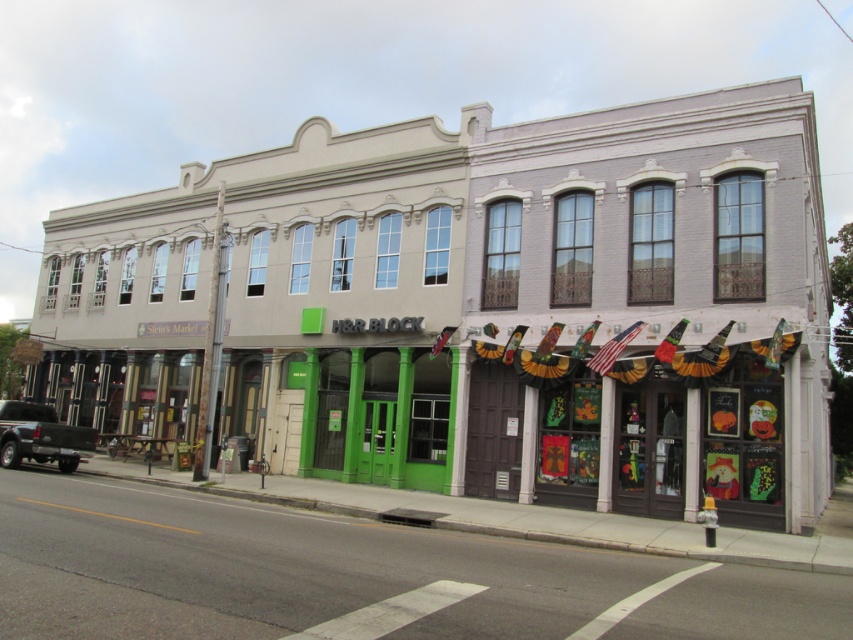
From the picture: You are a delivery driver who needs to park your matte black truck at lower left near the white brick building at center. Can you park the truck directly in front of the building?

The white brick building at center is above matte black truck at lower left, meaning the truck is already positioned at a lower level relative to the building. Since the truck is already at the lower left and the building is above it, you can park the truck directly in front of the white brick building at center as they are aligned vertically.

You are standing at the point marked as point (479, 307) in the image. What is located directly in front of you?

The white brick building at center is located directly in front of you at point (479, 307).

You are a delivery driver who needs to park your truck exactly 30 feet away from the white brick building at center. Can you park the matte black truck at lower left in the current position?

The distance between the white brick building at center and the matte black truck at lower left is 32.93 feet, which is more than 30 feet. Therefore, the matte black truck at lower left is parked farther away than the required distance.